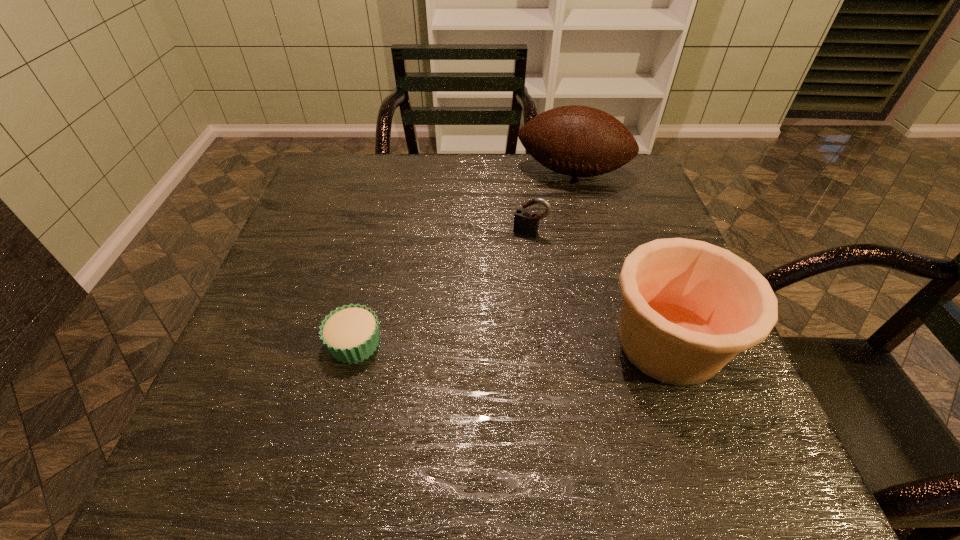
The image size is (960, 540). I want to click on free space located with the keyhole on the front of the third nearest object, so click(497, 295).

Identify the location of free spot located on the laces of the football. (562, 202).

Where is `free space located on the laces of the football`? The image size is (960, 540). free space located on the laces of the football is located at coordinates (544, 286).

The width and height of the screenshot is (960, 540). I want to click on vacant space located 0.320m on the laces of the football, so click(547, 271).

The height and width of the screenshot is (540, 960). I want to click on object at the far edge, so click(x=580, y=141).

Where is `object located in the near edge section of the desktop`? Image resolution: width=960 pixels, height=540 pixels. object located in the near edge section of the desktop is located at coordinates (689, 307).

This screenshot has width=960, height=540. I want to click on pottery positioned at the right edge, so click(689, 307).

Locate an element on the screen. This screenshot has width=960, height=540. football present at the right edge is located at coordinates (580, 141).

Identify the location of object present at the far right corner. (580, 141).

Identify the location of object that is at the near right corner. The width and height of the screenshot is (960, 540). pos(689,307).